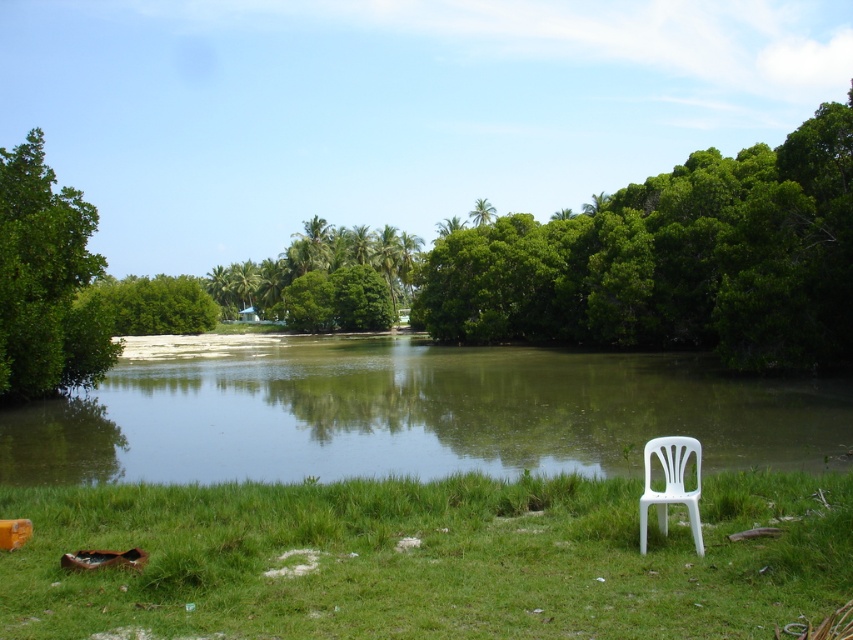
Question: Is green grass at lower right thinner than green leafy tree at upper center?

Choices:
 (A) yes
 (B) no

Answer: (A)

Question: Does green grass at lower right have a lesser width compared to green leafy tree at center?

Choices:
 (A) yes
 (B) no

Answer: (A)

Question: Does green grass at lower right appear under white plastic chair at lower right?

Choices:
 (A) no
 (B) yes

Answer: (B)

Question: Based on their relative distances, which object is nearer to the green leafy tree at left?

Choices:
 (A) green grass at lower right
 (B) green grassy lake at center
 (C) green leafy tree at center
 (D) green leafy tree at upper center

Answer: (B)

Question: Based on their relative distances, which object is farther from the white plastic chair at lower right?

Choices:
 (A) green grass at lower right
 (B) green leafy tree at upper center

Answer: (B)

Question: Which object is closer to the camera taking this photo?

Choices:
 (A) green leafy tree at left
 (B) green leafy tree at center
 (C) green grass at lower right

Answer: (C)